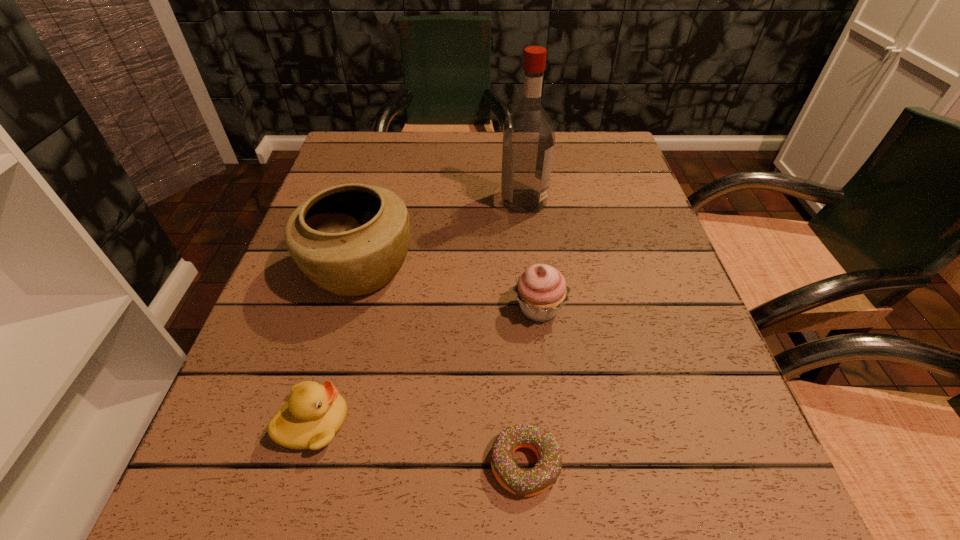
Identify the location of the tallest object. (528, 136).

This screenshot has height=540, width=960. Identify the location of liquor. (528, 136).

Where is `the fourth shortest object`? Image resolution: width=960 pixels, height=540 pixels. the fourth shortest object is located at coordinates (352, 239).

Find the location of a particular element. The height and width of the screenshot is (540, 960). the third tallest object is located at coordinates (541, 290).

You are a GUI agent. You are given a task and a screenshot of the screen. Output one action in this format:
    pyautogui.click(x=<x>, y=<y>)
    Task: Click on the duckling
    The height and width of the screenshot is (540, 960).
    Given the screenshot: What is the action you would take?
    pyautogui.click(x=314, y=413)

Where is `the shortest object`? the shortest object is located at coordinates (522, 482).

The width and height of the screenshot is (960, 540). I want to click on free spot located on the front-facing side of the farthest object, so click(348, 201).

Where is `free spot located 0.130m on the front-facing side of the farthest object`? free spot located 0.130m on the front-facing side of the farthest object is located at coordinates (445, 201).

This screenshot has width=960, height=540. What are the coordinates of `vacant space situated on the front-facing side of the farthest object` in the screenshot? It's located at (412, 201).

Where is `vacant space located 0.060m on the back of the second tallest object`? The image size is (960, 540). vacant space located 0.060m on the back of the second tallest object is located at coordinates (373, 216).